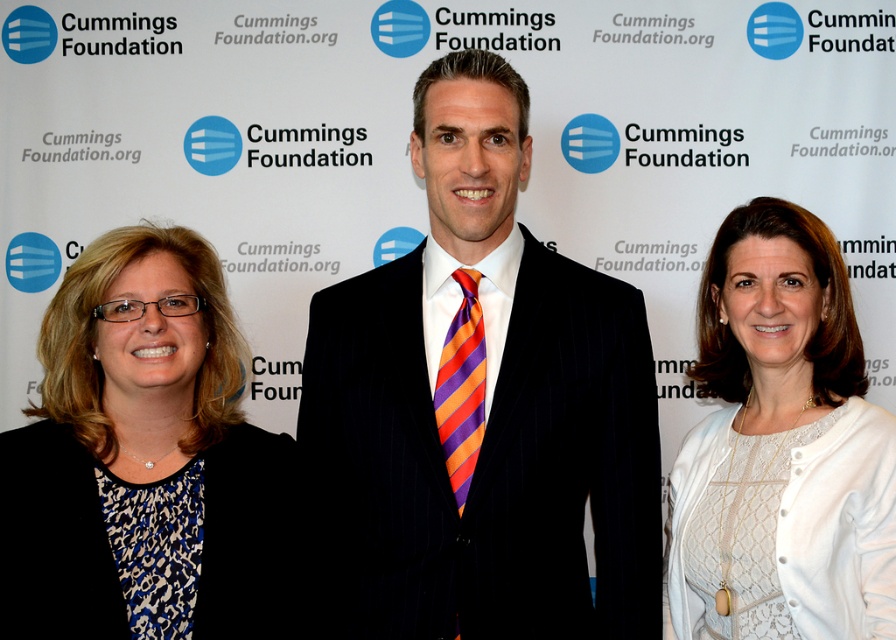
You are attending a virtual meeting and need to determine which item is taller between the blue printed blouse at left and the orange and purple striped tie at center. Based on the scene description, which one is taller?

The blue printed blouse at left is taller than the orange and purple striped tie at center according to the description.

Consider the image. You are a photographer setting up for a group photo. You need to ensure that the velvet black suit at center and the white lace dress at center are both clearly visible in the frame. Given their widths, which one might require more space to accommodate its width in the photo?

The velvet black suit at center is wider than the white lace dress at center, so it would require more space to accommodate its width in the photo.

You are a photographer setting up for a group photo. You need to ensure that the distance between the white lace dress at center and the orange and purple striped tie at center is at least 20 inches to avoid overlapping in the photo. Based on the scene description, will this requirement be met?

The distance between the white lace dress at center and the orange and purple striped tie at center is 22.77 inches, which is more than the required 20 inches. Therefore, the requirement is met and they will not overlap in the photo.